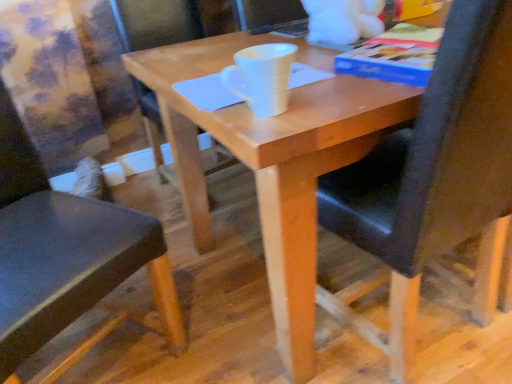
The height and width of the screenshot is (384, 512). What do you see at coordinates (263, 77) in the screenshot?
I see `white matte mug at center` at bounding box center [263, 77].

What do you see at coordinates (275, 162) in the screenshot? The image size is (512, 384). I see `wooden table at center` at bounding box center [275, 162].

Locate an element on the screen. blue paper at upper right is located at coordinates [x=394, y=56].

Image resolution: width=512 pixels, height=384 pixels. I want to click on black leather chair at left, which appears as the first chair when viewed from the left, so click(67, 260).

Considering the relative positions of blue paper at upper right and black leather chair at center, acting as the first chair starting from the right, in the image provided, is blue paper at upper right to the left of black leather chair at center, acting as the first chair starting from the right, from the viewer's perspective?

Yes, blue paper at upper right is to the left of black leather chair at center, acting as the first chair starting from the right.

Is blue paper at upper right placed right next to black leather chair at center, acting as the 2th chair starting from the left?

blue paper at upper right and black leather chair at center, acting as the 2th chair starting from the left, are not in contact.

Considering the points (393, 49) and (362, 230), which point is behind, point (393, 49) or point (362, 230)?

Positioned behind is point (362, 230).

Does blue paper at upper right come behind black leather chair at center, acting as the 2th chair starting from the left?

Yes, blue paper at upper right is behind black leather chair at center, acting as the 2th chair starting from the left.

Is black leather chair at left, which appears as the first chair when viewed from the left, inside or outside of blue paper at upper right?

black leather chair at left, which appears as the first chair when viewed from the left, is located beyond the bounds of blue paper at upper right.

From the image's perspective, between black leather chair at left, the 2th chair when ordered from right to left, and blue paper at upper right, who is located below?

black leather chair at left, the 2th chair when ordered from right to left, from the image's perspective.

In the image, there is a black leather chair at left, the 2th chair when ordered from right to left. Identify the location of paperback book above it (from the image's perspective). This screenshot has height=384, width=512. (394, 56).

Considering the relative positions of black leather chair at left, which appears as the first chair when viewed from the left, and blue paper at upper right in the image provided, is black leather chair at left, which appears as the first chair when viewed from the left, to the left or to the right of blue paper at upper right?

From the image, it's evident that black leather chair at left, which appears as the first chair when viewed from the left, is to the left of blue paper at upper right.

From the image's perspective, is wooden table at center over white matte mug at center?

No.

Can you see wooden table at center touching white matte mug at center?

wooden table at center and white matte mug at center are clearly separated.

Is wooden table at center at the right side of white matte mug at center?

Correct, you'll find wooden table at center to the right of white matte mug at center.

From the image's perspective, is white matte mug at center over black leather chair at center, acting as the first chair starting from the right?

Yes, from the image's perspective, white matte mug at center is over black leather chair at center, acting as the first chair starting from the right.

Could you measure the distance between white matte mug at center and black leather chair at center, acting as the first chair starting from the right?

white matte mug at center and black leather chair at center, acting as the first chair starting from the right, are 16.75 inches apart.

Is white matte mug at center facing away from black leather chair at center, acting as the 2th chair starting from the left?

That's not correct — white matte mug at center is not looking away from black leather chair at center, acting as the 2th chair starting from the left.

Considering the sizes of objects white matte mug at center and black leather chair at center, acting as the 2th chair starting from the left, in the image provided, who is bigger, white matte mug at center or black leather chair at center, acting as the 2th chair starting from the left,?

black leather chair at center, acting as the 2th chair starting from the left, is bigger.

From a real-world perspective, is black leather chair at center, acting as the first chair starting from the right, on wooden table at center?

Yes.

Is black leather chair at center, acting as the 2th chair starting from the left, aimed at wooden table at center?

Yes, black leather chair at center, acting as the 2th chair starting from the left, faces towards wooden table at center.

Between black leather chair at center, acting as the 2th chair starting from the left, and wooden table at center, which one has less height?

wooden table at center.

In terms of width, does white matte mug at center look wider or thinner when compared to black leather chair at left, which appears as the first chair when viewed from the left?

Considering their sizes, white matte mug at center looks slimmer than black leather chair at left, which appears as the first chair when viewed from the left.

Would you say white matte mug at center is inside or outside black leather chair at left, the 2th chair when ordered from right to left?

white matte mug at center cannot be found inside black leather chair at left, the 2th chair when ordered from right to left.

From a real-world perspective, is white matte mug at center positioned over black leather chair at left, which appears as the first chair when viewed from the left, based on gravity?

Yes, from a real-world perspective, white matte mug at center is over black leather chair at left, which appears as the first chair when viewed from the left

From a real-world perspective, count 1st chairs downward from the white matte mug at center and point to it. Please provide its 2D coordinates.

[(67, 260)]

Considering the sizes of objects wooden table at center and blue paper at upper right in the image provided, who is smaller, wooden table at center or blue paper at upper right?

blue paper at upper right.

Between point (308, 215) and point (437, 39), which one is positioned in front?

The point (308, 215) is closer to the camera.

From a real-world perspective, is wooden table at center under blue paper at upper right?

Indeed, from a real-world perspective, wooden table at center is positioned beneath blue paper at upper right.

Where is `desk on the right of blue paper at upper right`? desk on the right of blue paper at upper right is located at coordinates (275, 162).

You are a GUI agent. You are given a task and a screenshot of the screen. Output one action in this format:
    pyautogui.click(x=<x>, y=<y>)
    Task: Click on the paperback book positioned vertically above the black leather chair at center, acting as the 2th chair starting from the left (from a real-world perspective)
    The width and height of the screenshot is (512, 384).
    Given the screenshot: What is the action you would take?
    pyautogui.click(x=394, y=56)

There is a blue paper at upper right. Where is `the 1st chair below it (from a real-world perspective)`? This screenshot has height=384, width=512. the 1st chair below it (from a real-world perspective) is located at coordinates (67, 260).

From the image, which object appears to be farther from white matte mug at center, black leather chair at left, which appears as the first chair when viewed from the left, or wooden table at center?

black leather chair at left, which appears as the first chair when viewed from the left, is positioned further to the anchor white matte mug at center.

Estimate the real-world distances between objects in this image. Which object is further from wooden table at center, black leather chair at left, the 2th chair when ordered from right to left, or white matte mug at center?

Based on the image, black leather chair at left, the 2th chair when ordered from right to left, appears to be further to wooden table at center.

Estimate the real-world distances between objects in this image. Which object is further from blue paper at upper right, black leather chair at left, the 2th chair when ordered from right to left, or white matte mug at center?

Among the two, black leather chair at left, the 2th chair when ordered from right to left, is located further to blue paper at upper right.

Based on their spatial positions, is blue paper at upper right or black leather chair at left, which appears as the first chair when viewed from the left, further from wooden table at center?

black leather chair at left, which appears as the first chair when viewed from the left, is further to wooden table at center.

Based on their spatial positions, is black leather chair at center, acting as the first chair starting from the right, or blue paper at upper right further from wooden table at center?

The object further to wooden table at center is blue paper at upper right.

Looking at the image, which one is located further to black leather chair at center, acting as the 2th chair starting from the left, wooden table at center or blue paper at upper right?

The object further to black leather chair at center, acting as the 2th chair starting from the left, is blue paper at upper right.

From the picture: Considering their positions, is wooden table at center positioned closer to blue paper at upper right than black leather chair at center, acting as the 2th chair starting from the left?

The object closer to blue paper at upper right is black leather chair at center, acting as the 2th chair starting from the left.

Considering their positions, is white matte mug at center positioned further to wooden table at center than black leather chair at center, acting as the 2th chair starting from the left?

Based on the image, white matte mug at center appears to be further to wooden table at center.

Identify the location of paperback book situated between black leather chair at left, the 2th chair when ordered from right to left, and black leather chair at center, acting as the 2th chair starting from the left, from left to right. The height and width of the screenshot is (384, 512). (394, 56).

I want to click on coffee cup located between black leather chair at left, the 2th chair when ordered from right to left, and blue paper at upper right in the left-right direction, so click(x=263, y=77).

In order to click on chair situated between white matte mug at center and wooden table at center from left to right in this screenshot , I will do `click(436, 176)`.

In order to click on chair located between black leather chair at left, which appears as the first chair when viewed from the left, and wooden table at center in the left-right direction in this screenshot , I will do `click(436, 176)`.